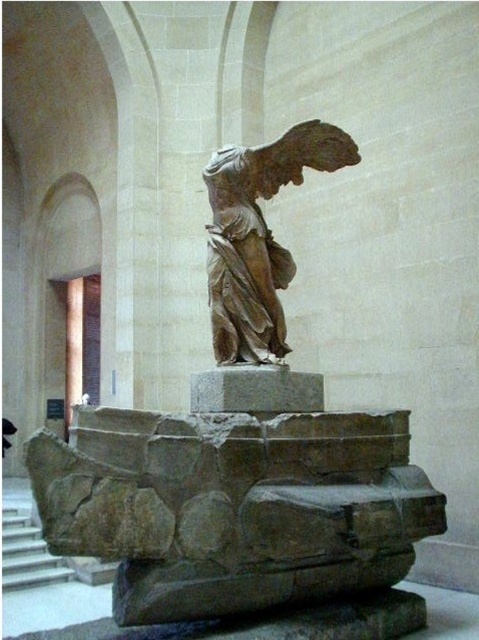
Question: Which object appears farthest from the camera in this image?

Choices:
 (A) white marble stairs at lower left
 (B) matte bronze statue at center

Answer: (A)

Question: Considering the relative positions of matte bronze statue at center and white marble stairs at lower left in the image provided, where is matte bronze statue at center located with respect to white marble stairs at lower left?

Choices:
 (A) left
 (B) right

Answer: (B)

Question: Does matte bronze statue at center lie in front of white marble stairs at lower left?

Choices:
 (A) no
 (B) yes

Answer: (B)

Question: Does matte bronze statue at center have a larger size compared to white marble stairs at lower left?

Choices:
 (A) yes
 (B) no

Answer: (A)